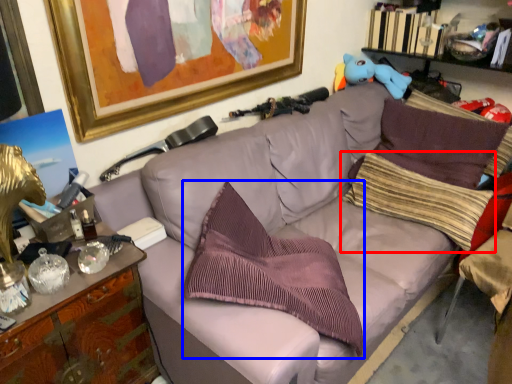
Question: Which object is further to the camera taking this photo, pillow (highlighted by a red box) or pillow (highlighted by a blue box)?

Choices:
 (A) pillow
 (B) pillow

Answer: (A)